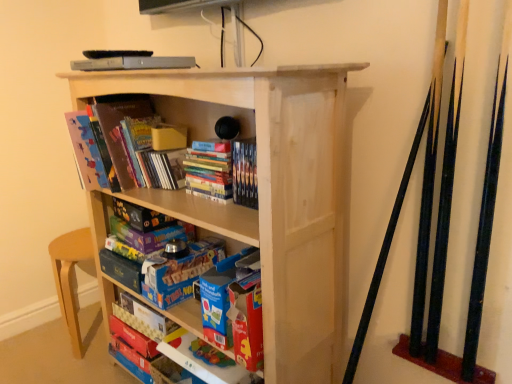
Question: Is the depth of natural wood bookcase at center less than that of matte cardboard book at left, which appears as the third book when ordered from the bottom?

Choices:
 (A) yes
 (B) no

Answer: (A)

Question: Is natural wood bookcase at center not close to matte cardboard book at left, which appears as the third book when ordered from the bottom?

Choices:
 (A) no
 (B) yes

Answer: (A)

Question: Is natural wood bookcase at center shorter than matte cardboard book at left, which appears as the third book when ordered from the bottom?

Choices:
 (A) no
 (B) yes

Answer: (A)

Question: Can you confirm if natural wood bookcase at center is smaller than matte cardboard book at left, which appears as the first book when viewed from the top?

Choices:
 (A) no
 (B) yes

Answer: (A)

Question: Does natural wood bookcase at center appear on the left side of matte cardboard book at left, which appears as the third book when ordered from the bottom?

Choices:
 (A) yes
 (B) no

Answer: (B)

Question: Considering the positions of natural wood bookcase at center and matte cardboard book at left, which appears as the third book when ordered from the bottom, in the image, is natural wood bookcase at center bigger or smaller than matte cardboard book at left, which appears as the third book when ordered from the bottom,?

Choices:
 (A) small
 (B) big

Answer: (B)

Question: From a real-world perspective, relative to matte cardboard book at left, which appears as the third book when ordered from the bottom, is natural wood bookcase at center vertically above or below?

Choices:
 (A) above
 (B) below

Answer: (B)

Question: Is natural wood bookcase at center inside the boundaries of matte cardboard book at left, which appears as the third book when ordered from the bottom, or outside?

Choices:
 (A) outside
 (B) inside

Answer: (A)

Question: In terms of height, does natural wood bookcase at center look taller or shorter compared to matte cardboard book at left, which appears as the third book when ordered from the bottom?

Choices:
 (A) short
 (B) tall

Answer: (B)

Question: Relative to hardcover books at center, the 2th book in the top-to-bottom sequence, is matte cardboard book at lower center, which is counted as the 1th book, starting from the bottom, in front or behind?

Choices:
 (A) behind
 (B) front

Answer: (A)

Question: Choose the correct answer: Is matte cardboard book at lower center, positioned as the third book in top-to-bottom order, inside hardcover books at center, the 2th book in the top-to-bottom sequence, or outside it?

Choices:
 (A) outside
 (B) inside

Answer: (A)

Question: Is matte cardboard book at lower center, positioned as the third book in top-to-bottom order, bigger or smaller than hardcover books at center, which appears as the 2th book when ordered from the bottom?

Choices:
 (A) big
 (B) small

Answer: (B)

Question: From the image's perspective, is matte cardboard book at lower center, which is counted as the 1th book, starting from the bottom, located above or below hardcover books at center, which appears as the 2th book when ordered from the bottom?

Choices:
 (A) below
 (B) above

Answer: (A)

Question: From the image's perspective, relative to matte cardboard book at left, which appears as the third book when ordered from the bottom, is matte cardboard book at lower center, which is counted as the 1th book, starting from the bottom, above or below?

Choices:
 (A) below
 (B) above

Answer: (A)

Question: Is point (128, 322) closer or farther from the camera than point (182, 110)?

Choices:
 (A) closer
 (B) farther

Answer: (B)